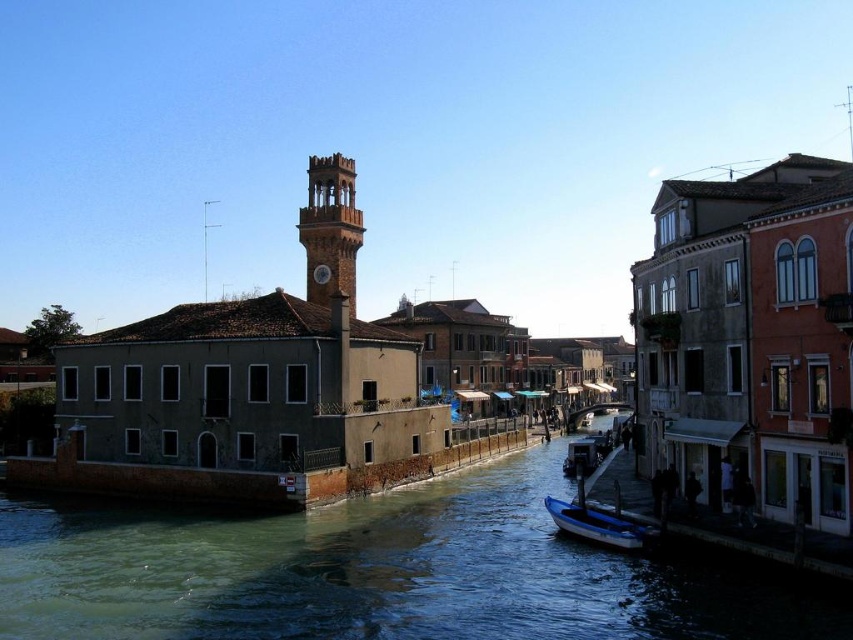
You are a tourist standing on the dock near the canal. You want to take a photo of the blue glossy boat at lower center without the greenish water at center in the background. Is it possible to do so given their sizes?

The greenish water at center is wider than the blue glossy boat at lower center, so it might be challenging to frame the photo in a way that excludes the greenish water at center entirely. However, adjusting the camera angle or zoom could help minimize its presence.

You are a tourist standing on the bank of the canal and want to take a photo that includes both the brown stone clock tower at center and the blue glossy boat at lower center. Which object should you position closer to the edge of the frame to ensure both are fully visible?

You should position the blue glossy boat at lower center closer to the edge of the frame because the brown stone clock tower at center is taller than the blue glossy boat at lower center, so the tower may block part of the boat if placed centrally.

You are a tourist standing on the dock near the canal and want to take a photo of the blue glossy boat at lower center without the greenish water at center showing in the background. Is it possible to do so by adjusting your position?

The greenish water at center is positioned under the blue glossy boat at lower center, so if you move to a position where the boat is centered in your viewfinder and slightly tilt the camera upwards to avoid the water below the boat, you can achieve this.